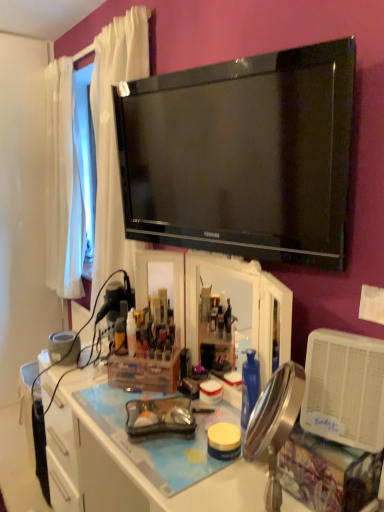
This screenshot has width=384, height=512. What do you see at coordinates (274, 424) in the screenshot?
I see `metallic gold mirror at center` at bounding box center [274, 424].

At what (x,y) coordinates should I click in order to perform the action: click on translucent plastic container at center. Please return your answer as a coordinate pair (x, y). The height and width of the screenshot is (512, 384). Looking at the image, I should click on (144, 373).

Image resolution: width=384 pixels, height=512 pixels. What do you see at coordinates (120, 336) in the screenshot? I see `translucent plastic bottle at center, the first bottle when ordered from left to right` at bounding box center [120, 336].

This screenshot has height=512, width=384. Identify the location of clear plastic desk at center. (136, 458).

Locate an element on the screen. bottle directly beneath the metallic gold mirror at center (from a real-world perspective) is located at coordinates (120, 336).

Which object is closer to the camera, translucent plastic bottle at center, the first bottle when ordered from left to right, or metallic gold mirror at center?

metallic gold mirror at center is closer to the camera.

Is translucent plastic bottle at center, which is the 2th bottle in right-to-left order, far away from metallic gold mirror at center?

translucent plastic bottle at center, which is the 2th bottle in right-to-left order, is near metallic gold mirror at center, not far away.

Does translucent plastic bottle at center, which is the 2th bottle in right-to-left order, contain metallic gold mirror at center?

Actually, metallic gold mirror at center is outside translucent plastic bottle at center, which is the 2th bottle in right-to-left order.

Is point (280, 182) in front of point (115, 344)?

Yes, point (280, 182) is closer to viewer.

Which of these two, black glossy tv at upper center or translucent plastic bottle at center, the first bottle when ordered from left to right, is bigger?

black glossy tv at upper center is bigger.

From the image's perspective, which object appears higher, black glossy tv at upper center or translucent plastic bottle at center, the first bottle when ordered from left to right?

black glossy tv at upper center appears higher in the image.

Is translucent plastic bottle at center, the 1th bottle when ordered from right to left, oriented towards translucent plastic bottle at center, the first bottle when ordered from left to right?

No, translucent plastic bottle at center, the 1th bottle when ordered from right to left, is not oriented towards translucent plastic bottle at center, the first bottle when ordered from left to right.

Looking at their sizes, would you say translucent plastic bottle at center, the 1th bottle when ordered from right to left, is wider or thinner than translucent plastic bottle at center, which is the 2th bottle in right-to-left order?

Considering their sizes, translucent plastic bottle at center, the 1th bottle when ordered from right to left, looks slimmer than translucent plastic bottle at center, which is the 2th bottle in right-to-left order.

Considering the positions of points (134, 331) and (121, 318), is point (134, 331) closer to camera compared to point (121, 318)?

Yes, it is in front of point (121, 318).

From a real-world perspective, does translucent plastic bottle at center, which is the second bottle in left-to-right order, stand above translucent plastic bottle at center, the first bottle when ordered from left to right?

Correct, in the physical world, translucent plastic bottle at center, which is the second bottle in left-to-right order, is higher than translucent plastic bottle at center, the first bottle when ordered from left to right.

In terms of size, does translucent plastic bottle at center, which is the 2th bottle in right-to-left order, appear bigger or smaller than translucent plastic container at center?

In the image, translucent plastic bottle at center, which is the 2th bottle in right-to-left order, appears to be smaller than translucent plastic container at center.

From the translucent plastic container at center, count the 2nd bottle to the left and point to it. Please provide its 2D coordinates.

[(120, 336)]

Is translucent plastic bottle at center, the first bottle when ordered from left to right, not near translucent plastic container at center?

That's not correct — translucent plastic bottle at center, the first bottle when ordered from left to right, is a little close to translucent plastic container at center.

From the image's perspective, does translucent plastic bottle at center, which is the 2th bottle in right-to-left order, appear lower than translucent plastic container at center?

Actually, translucent plastic bottle at center, which is the 2th bottle in right-to-left order, appears above translucent plastic container at center in the image.

Considering the relative sizes of metallic gold mirror at center and translucent plastic bottle at center, the 1th bottle when ordered from right to left, in the image provided, is metallic gold mirror at center bigger than translucent plastic bottle at center, the 1th bottle when ordered from right to left,?

Yes, metallic gold mirror at center is bigger than translucent plastic bottle at center, the 1th bottle when ordered from right to left.

Is metallic gold mirror at center positioned with its back to translucent plastic bottle at center, the 1th bottle when ordered from right to left?

No, metallic gold mirror at center is not facing the opposite direction of translucent plastic bottle at center, the 1th bottle when ordered from right to left.

From a real-world perspective, is metallic gold mirror at center above or below translucent plastic bottle at center, which is the second bottle in left-to-right order?

From a real-world perspective, metallic gold mirror at center is physically below translucent plastic bottle at center, which is the second bottle in left-to-right order.

Considering the sizes of objects metallic gold mirror at center and translucent plastic container at center in the image provided, who is smaller, metallic gold mirror at center or translucent plastic container at center?

Smaller between the two is translucent plastic container at center.

Looking at this image, which of these two, metallic gold mirror at center or translucent plastic container at center, is wider?

Wider between the two is translucent plastic container at center.

Which point is more forward, (290, 411) or (161, 366)?

Point (290, 411)

Is metallic gold mirror at center far away from translucent plastic bottle at center, the first bottle when ordered from left to right?

That's not correct — metallic gold mirror at center is a little close to translucent plastic bottle at center, the first bottle when ordered from left to right.

Based on their positions, is metallic gold mirror at center located to the left or right of translucent plastic bottle at center, which is the 2th bottle in right-to-left order?

metallic gold mirror at center is positioned on translucent plastic bottle at center, which is the 2th bottle in right-to-left order,'s right side.

From the image's perspective, between metallic gold mirror at center and translucent plastic bottle at center, the first bottle when ordered from left to right, which one is located above?

translucent plastic bottle at center, the first bottle when ordered from left to right, appears higher in the image.

The height and width of the screenshot is (512, 384). Find the location of `mirror above the translucent plastic bottle at center, which is the 2th bottle in right-to-left order (from a real-world perspective)`. mirror above the translucent plastic bottle at center, which is the 2th bottle in right-to-left order (from a real-world perspective) is located at coordinates (274, 424).

Identify the location of the 2nd bottle behind the metallic gold mirror at center, starting your count from the anchor. This screenshot has width=384, height=512. 120,336.

In order to click on television above the translucent plastic bottle at center, the first bottle when ordered from left to right (from a real-world perspective) in this screenshot , I will do `click(242, 155)`.

From the image, which object appears to be nearer to translucent plastic container at center, clear plastic desk at center or metallic gold mirror at center?

clear plastic desk at center lies closer to translucent plastic container at center than the other object.

Considering their positions, is metallic gold mirror at center positioned further to translucent plastic container at center than clear plastic desk at center?

metallic gold mirror at center lies further to translucent plastic container at center than the other object.

Which object lies further to the anchor point translucent plastic bottle at center, which is the second bottle in left-to-right order, metallic gold mirror at center or clear plastic desk at center?

metallic gold mirror at center lies further to translucent plastic bottle at center, which is the second bottle in left-to-right order, than the other object.

Based on their spatial positions, is clear plastic desk at center or translucent plastic bottle at center, which is the 2th bottle in right-to-left order, closer to translucent plastic container at center?

The object closer to translucent plastic container at center is translucent plastic bottle at center, which is the 2th bottle in right-to-left order.

From the image, which object appears to be farther from clear plastic desk at center, translucent plastic container at center or translucent plastic bottle at center, which is the 2th bottle in right-to-left order?

translucent plastic bottle at center, which is the 2th bottle in right-to-left order, is positioned further to the anchor clear plastic desk at center.

From the picture: Which object lies nearer to the anchor point clear plastic desk at center, translucent plastic container at center or translucent plastic bottle at center, which is the second bottle in left-to-right order?

translucent plastic container at center.

From the image, which object appears to be farther from black glossy tv at upper center, translucent plastic container at center or clear plastic desk at center?

clear plastic desk at center.

Based on their spatial positions, is translucent plastic bottle at center, the 1th bottle when ordered from right to left, or clear plastic desk at center further from translucent plastic bottle at center, which is the 2th bottle in right-to-left order?

clear plastic desk at center.

The width and height of the screenshot is (384, 512). In order to click on box between metallic gold mirror at center and translucent plastic bottle at center, the first bottle when ordered from left to right, in the front-back direction in this screenshot , I will do `click(144, 373)`.

Identify the location of bottle positioned between metallic gold mirror at center and translucent plastic bottle at center, which is the 2th bottle in right-to-left order, from near to far. tap(131, 332).

Where is `box between clear plastic desk at center and translucent plastic bottle at center, the 1th bottle when ordered from right to left, from front to back`? Image resolution: width=384 pixels, height=512 pixels. box between clear plastic desk at center and translucent plastic bottle at center, the 1th bottle when ordered from right to left, from front to back is located at coordinates (144, 373).

Locate an element on the screen. mirror that lies between black glossy tv at upper center and translucent plastic container at center from top to bottom is located at coordinates (274, 424).